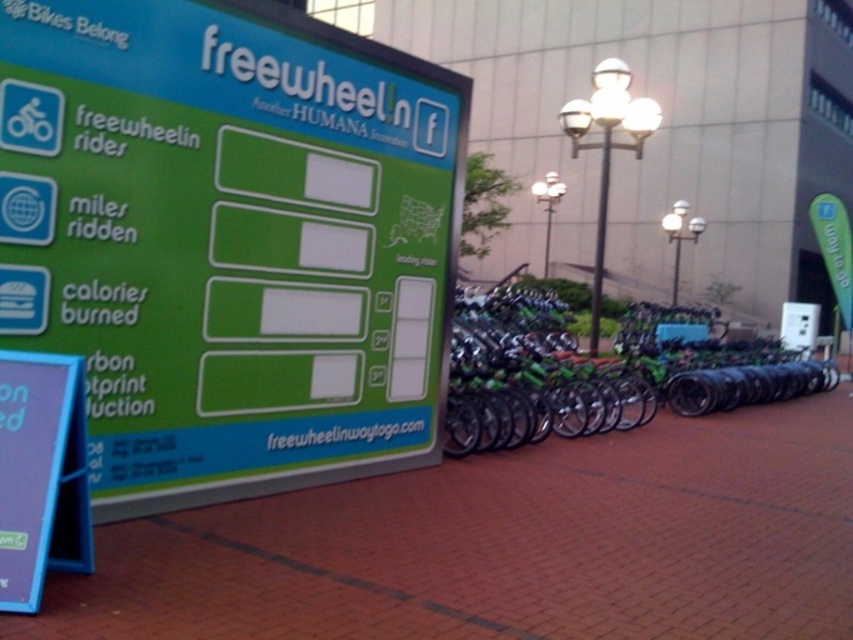
Question: Estimate the real-world distances between objects in this image. Which object is farther from the blue plastic sign at lower left?

Choices:
 (A) brick pavement at center
 (B) green matte bicycle at center

Answer: (B)

Question: Is green matte sign at upper left behind metallic pole at center?

Choices:
 (A) yes
 (B) no

Answer: (B)

Question: Can you confirm if green matte sign at upper left is thinner than blue plastic sign at lower left?

Choices:
 (A) yes
 (B) no

Answer: (B)

Question: Can you confirm if brick pavement at center is positioned above green matte bicycle at center?

Choices:
 (A) yes
 (B) no

Answer: (B)

Question: Which point is farther from the camera taking this photo?

Choices:
 (A) (26, 545)
 (B) (596, 262)
 (C) (131, 292)
 (D) (674, 387)

Answer: (B)

Question: Which object is the farthest from the green matte sign at upper left?

Choices:
 (A) blue plastic sign at lower left
 (B) brick pavement at center
 (C) metallic pole at center
 (D) green matte bicycle at center

Answer: (C)